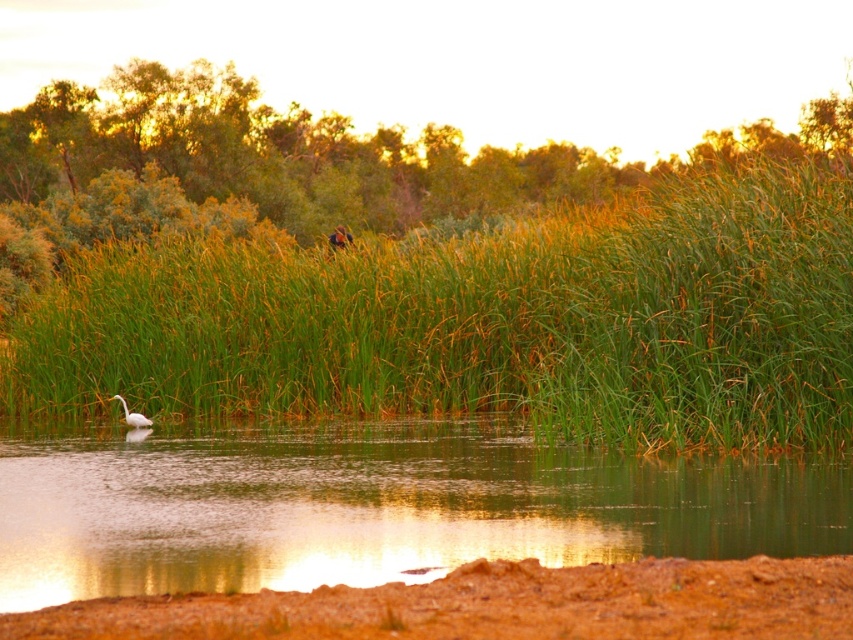
Who is positioned more to the right, green grass at center or clear water at center?

From the viewer's perspective, green grass at center appears more on the right side.

Identify the location of green grass at center. (489, 323).

Where is `green grass at center`? This screenshot has width=853, height=640. green grass at center is located at coordinates (489, 323).

Which is more to the left, green grass at center or white matte bird at lower left?

white matte bird at lower left

Is green grass at center to the left of white matte bird at lower left from the viewer's perspective?

No, green grass at center is not to the left of white matte bird at lower left.

Who is more distant from viewer, (194, 364) or (146, 420)?

Point (194, 364)

Locate an element on the screen. green grass at center is located at coordinates (489, 323).

Image resolution: width=853 pixels, height=640 pixels. I want to click on clear water at center, so click(x=373, y=506).

Locate an element on the screen. The height and width of the screenshot is (640, 853). clear water at center is located at coordinates (373, 506).